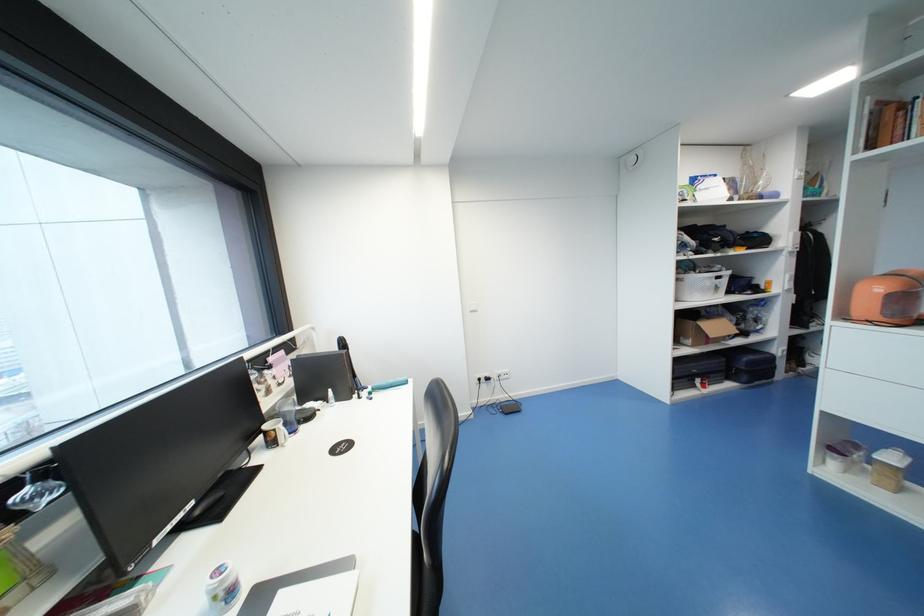
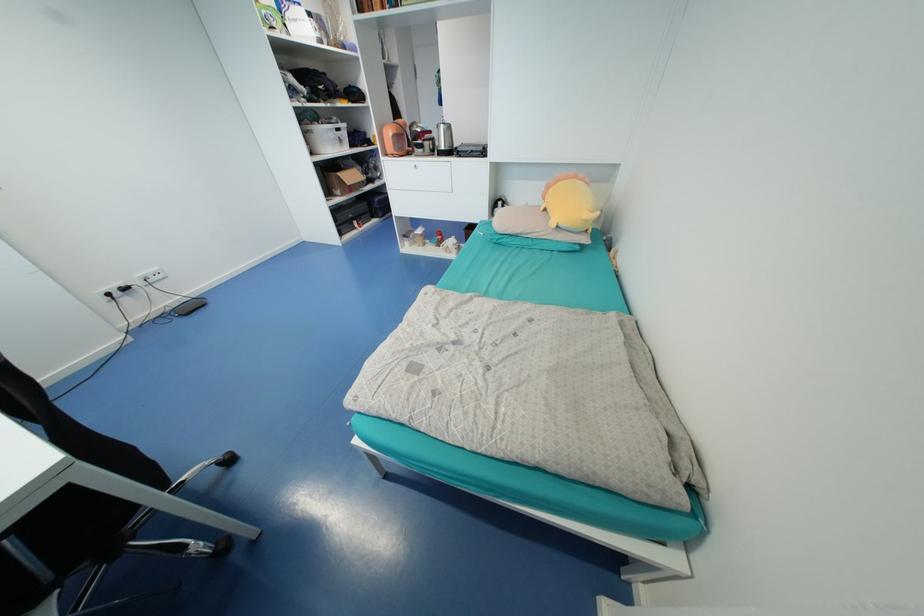
Locate, in the second image, the point that corresponds to point (721, 288) in the first image.

(345, 140)